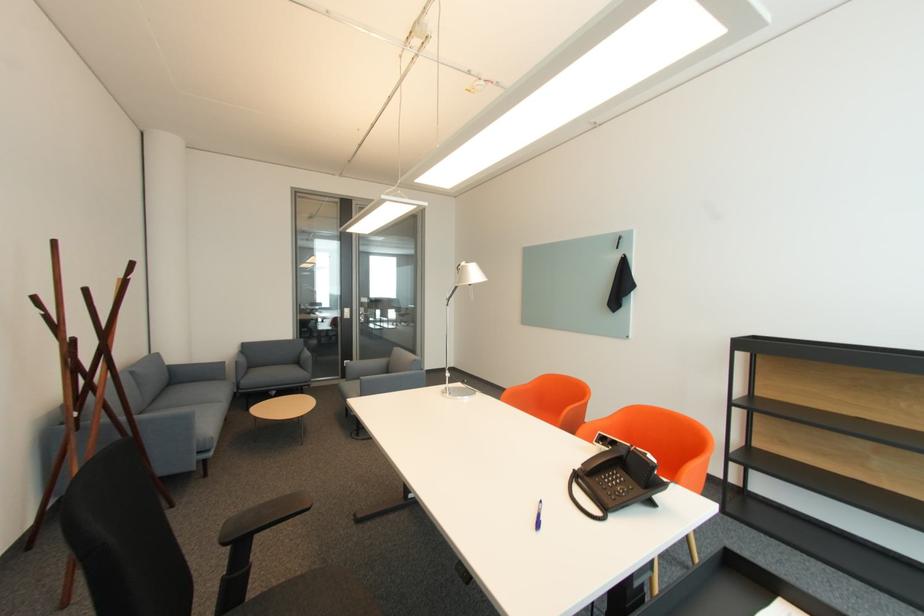
Where would you sit the sofa sitting surface? Please return your answer as a coordinate pair (x, y).

(178, 397)